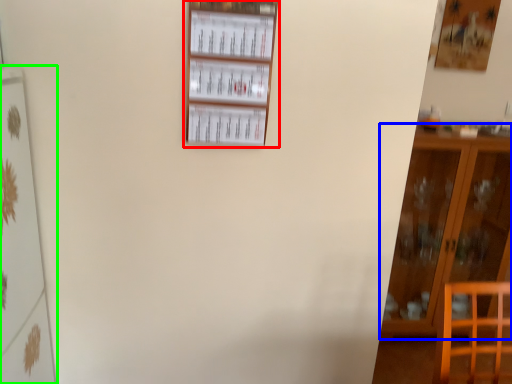
Question: Which object is positioned farthest from shelf (highlighted by a red box)? Select from furniture (highlighted by a blue box) and shelf (highlighted by a green box).

Choices:
 (A) furniture
 (B) shelf

Answer: (A)